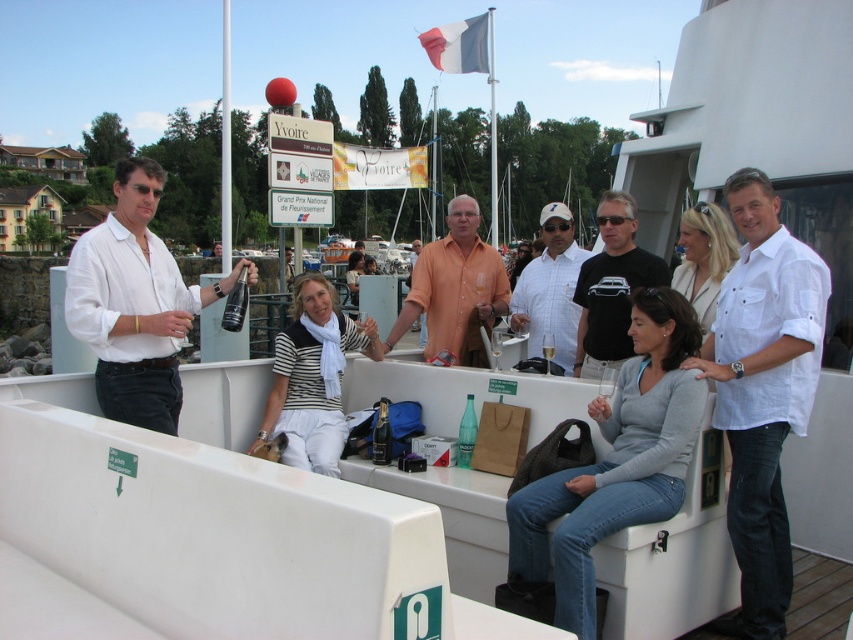
From the picture: You are standing on the boat deck and want to reach the point marked at coordinates (310,400). If your walking speed is 1.5 meters per second, how many seconds will it take you to reach that point?

The point marked at coordinates (310,400) is 5.38 meters away from the camera. At a walking speed of 1.5 meters per second, it would take approximately 3.59 seconds to reach the point.

You are a photographer trying to capture a group photo of the people on the boat deck. You notice two individuals wearing white striped shirt at center and white checkered shirt at center. Since you want to ensure everyone is visible, which person should you position closer to the front to avoid being blocked by others?

The white striped shirt at center should be positioned closer to the front because it is shorter than the white checkered shirt at center, ensuring they won t be blocked by taller individuals.